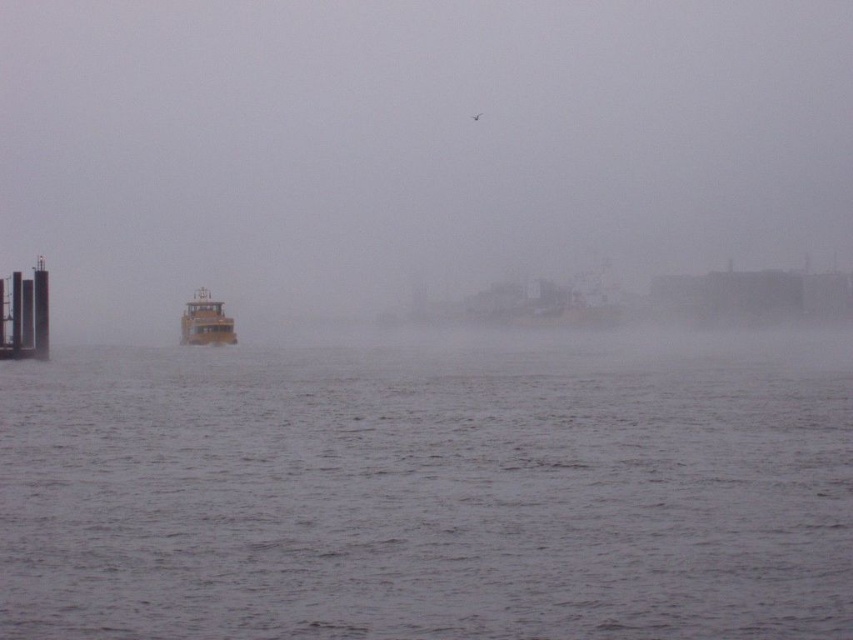
Question: Where is foggy atmosphere at left located in relation to gray matte water at center in the image?

Choices:
 (A) above
 (B) below

Answer: (A)

Question: Observing the image, what is the correct spatial positioning of gray matte water at center in reference to yellow matte boat at center?

Choices:
 (A) left
 (B) right

Answer: (B)

Question: Which point is closer to the camera taking this photo?

Choices:
 (A) (113, 387)
 (B) (724, 218)

Answer: (A)

Question: Among these objects, which one is nearest to the camera?

Choices:
 (A) smooth concrete dock at left
 (B) yellow matte boat at center
 (C) foggy atmosphere at left
 (D) gray matte water at center

Answer: (D)

Question: Which of the following is the closest to the observer?

Choices:
 (A) (228, 332)
 (B) (39, 285)

Answer: (B)

Question: Is foggy atmosphere at left to the right of gray matte water at center from the viewer's perspective?

Choices:
 (A) yes
 (B) no

Answer: (A)